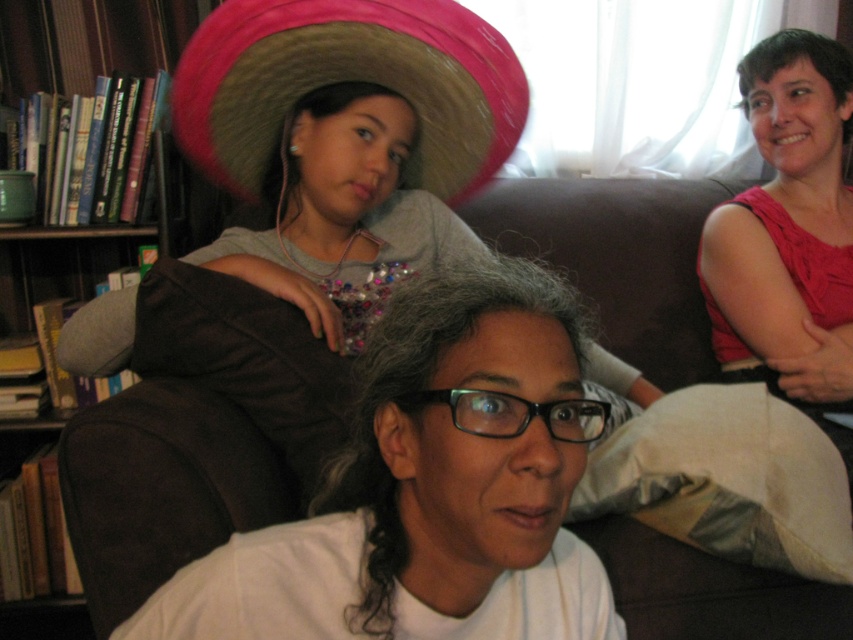
Question: Is brown fabric couch at center in front of pink fabric top at upper right?

Choices:
 (A) no
 (B) yes

Answer: (A)

Question: Is brown fabric couch at center to the right of pink straw sombrero at upper center from the viewer's perspective?

Choices:
 (A) yes
 (B) no

Answer: (A)

Question: Does brown fabric couch at center appear on the left side of pink straw sombrero at upper center?

Choices:
 (A) yes
 (B) no

Answer: (B)

Question: Estimate the real-world distances between objects in this image. Which object is farther from the pink straw sombrero at upper center?

Choices:
 (A) pink fabric top at upper right
 (B) brown fabric couch at center
 (C) wooden bookshelf at left

Answer: (C)

Question: Among these objects, which one is nearest to the camera?

Choices:
 (A) pink straw sombrero at upper center
 (B) brown fabric couch at center

Answer: (A)

Question: Which object is farther from the camera taking this photo?

Choices:
 (A) pink straw sombrero at upper center
 (B) brown fabric couch at center
 (C) pink fabric top at upper right
 (D) wooden bookshelf at left

Answer: (D)